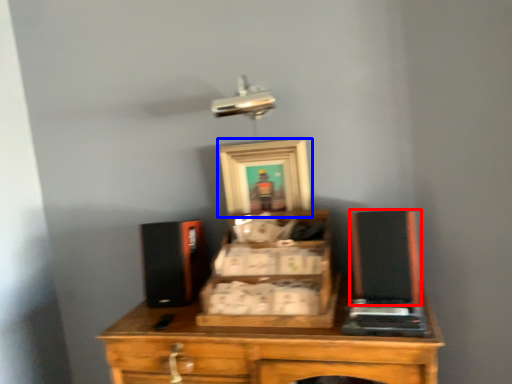
Question: Which object appears farthest to the camera in this image, wide (highlighted by a red box) or picture frame (highlighted by a blue box)?

Choices:
 (A) wide
 (B) picture frame

Answer: (B)